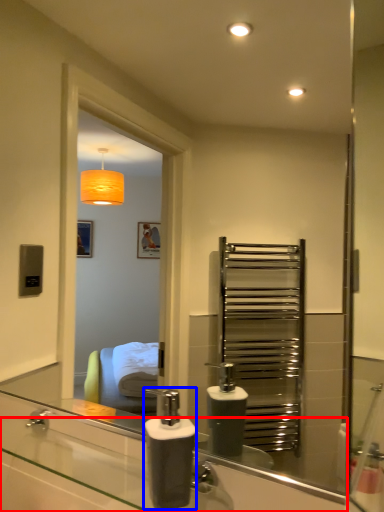
Question: Which of the following is the farthest to the observer, counter top (highlighted by a red box) or soap dispenser (highlighted by a blue box)?

Choices:
 (A) counter top
 (B) soap dispenser

Answer: (B)